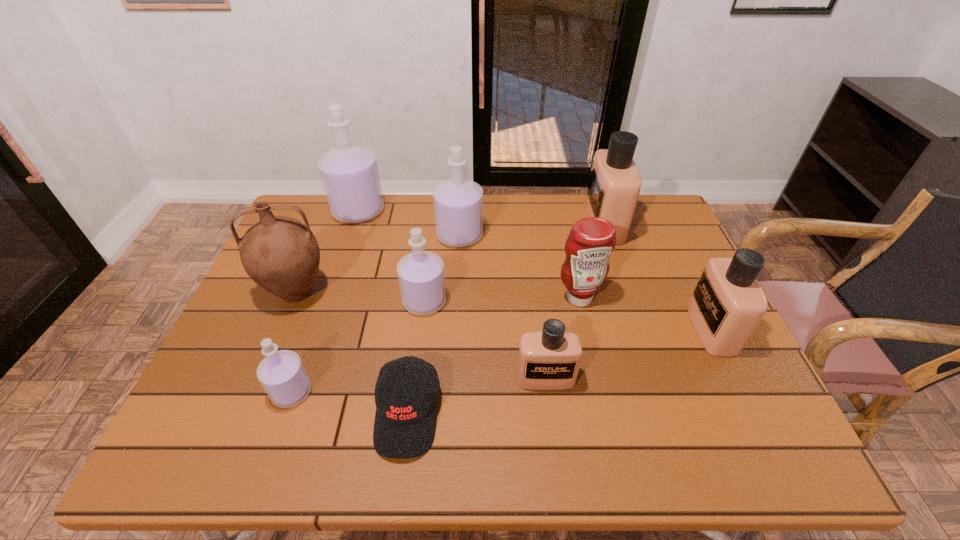
At what (x,y) coordinates should I click in order to perform the action: click on the tallest object. Please return your answer as a coordinate pair (x, y). Image resolution: width=960 pixels, height=540 pixels. Looking at the image, I should click on (349, 173).

You are a GUI agent. You are given a task and a screenshot of the screen. Output one action in this format:
    pyautogui.click(x=<x>, y=<y>)
    Task: Click on the biggest purple perfume
    The width and height of the screenshot is (960, 540).
    Given the screenshot: What is the action you would take?
    pyautogui.click(x=349, y=173)

Identify the location of the ninth object from left to right. (615, 182).

I want to click on the second perfume from right to left, so click(x=615, y=182).

Identify the location of the second biggest purple perfume. (458, 203).

Locate an element on the screen. This screenshot has height=540, width=960. pitcher is located at coordinates (281, 254).

Where is `red condiment`? red condiment is located at coordinates (591, 241).

What are the coordinates of `the third biggest purple perfume` in the screenshot? It's located at (421, 277).

Where is `the rightmost object`? This screenshot has width=960, height=540. the rightmost object is located at coordinates (727, 304).

The width and height of the screenshot is (960, 540). Identify the location of the rightmost perfume. (727, 304).